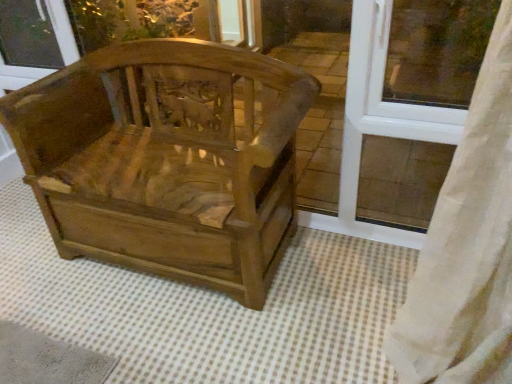
Question: From a real-world perspective, is transparent glass window screen at upper left above or below wooden carved chair at center?

Choices:
 (A) above
 (B) below

Answer: (A)

Question: From the image's perspective, is transparent glass window screen at upper left positioned above or below wooden carved chair at center?

Choices:
 (A) below
 (B) above

Answer: (B)

Question: Which object is positioned closest to the white plastic window frame at upper right?

Choices:
 (A) wooden carved chair at center
 (B) transparent glass window screen at upper left

Answer: (A)

Question: Estimate the real-world distances between objects in this image. Which object is closer to the transparent glass window screen at upper left?

Choices:
 (A) white plastic window frame at upper right
 (B) wooden carved chair at center

Answer: (B)